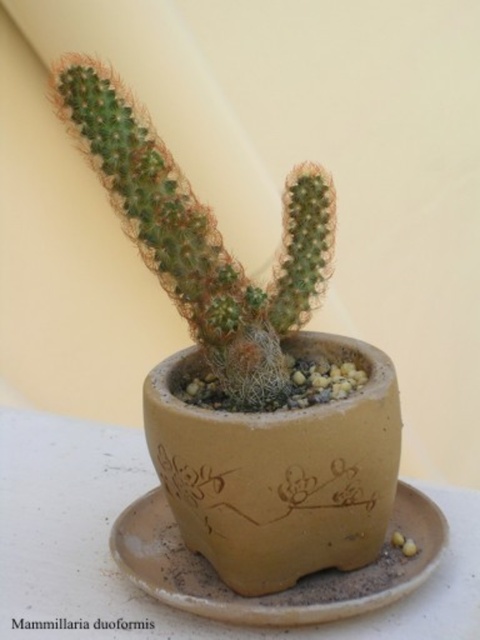
Is green spiky cactus at center to the left of brown matte saucer at center from the viewer's perspective?

Indeed, green spiky cactus at center is positioned on the left side of brown matte saucer at center.

The image size is (480, 640). Find the location of `green spiky cactus at center`. green spiky cactus at center is located at coordinates (202, 234).

Does green spiky cactus at center appear under green matte mammillaria duoformis at center?

No, green spiky cactus at center is not below green matte mammillaria duoformis at center.

Who is higher up, green spiky cactus at center or green matte mammillaria duoformis at center?

green spiky cactus at center

Find the location of `green spiky cactus at center`. green spiky cactus at center is located at coordinates (202, 234).

Is brown matte saucer at center to the left of green matte mammillaria duoformis at center from the viewer's perspective?

In fact, brown matte saucer at center is to the right of green matte mammillaria duoformis at center.

The height and width of the screenshot is (640, 480). Find the location of `brown matte saucer at center`. brown matte saucer at center is located at coordinates (289, 588).

Is point (424, 532) closer to viewer compared to point (124, 627)?

No, (424, 532) is behind (124, 627).

Locate an element on the screen. brown matte saucer at center is located at coordinates (289, 588).